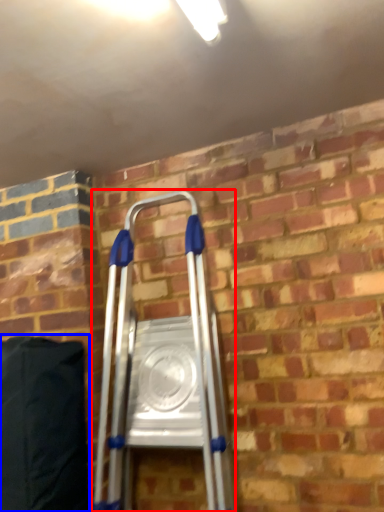
Question: Which object appears closest to the camera in this image, ladder (highlighted by a red box) or bean bag chair (highlighted by a blue box)?

Choices:
 (A) ladder
 (B) bean bag chair

Answer: (A)